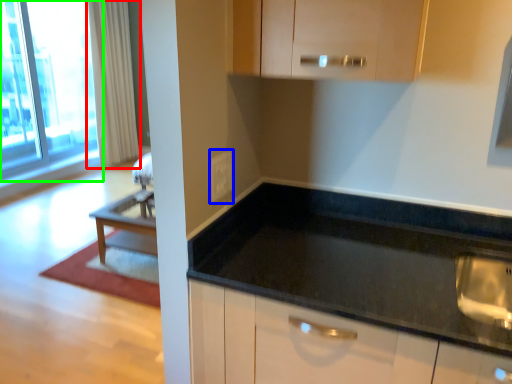
Question: Which object is the closest to the curtain (highlighted by a red box)? Choose among these: electric outlet (highlighted by a blue box) or window (highlighted by a green box).

Choices:
 (A) electric outlet
 (B) window

Answer: (B)